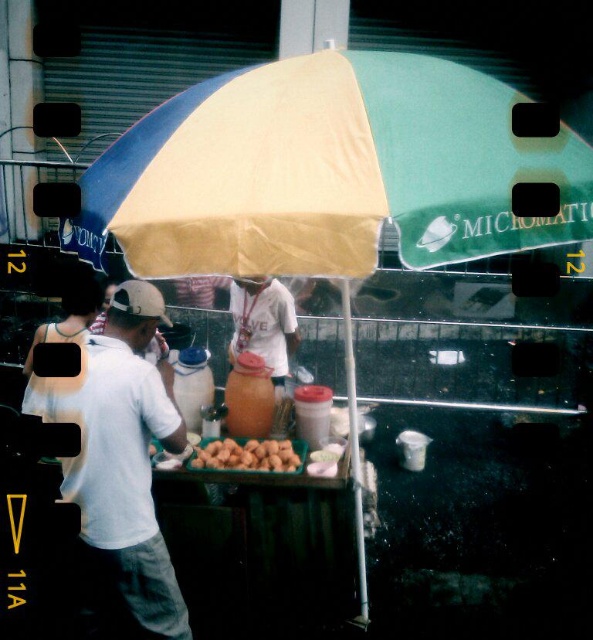
At what (x,y) coordinates should I click in order to perform the action: click on white matte shirt at center. Please return your answer as a coordinate pair (x, y). This screenshot has height=640, width=593. Looking at the image, I should click on (122, 458).

Measure the distance between white jersey at center and brown matte nuts at center.

A distance of 1.02 meters exists between white jersey at center and brown matte nuts at center.

Between white jersey at center and brown matte nuts at center, which one is positioned lower?

Positioned lower is brown matte nuts at center.

Find the location of a particular element. white jersey at center is located at coordinates (263, 323).

Can you confirm if white matte shirt at center is wider than brown matte nuts at center?

Yes.

Can you confirm if white matte shirt at center is taller than brown matte nuts at center?

Correct, white matte shirt at center is much taller as brown matte nuts at center.

What do you see at coordinates (122, 458) in the screenshot?
I see `white matte shirt at center` at bounding box center [122, 458].

The image size is (593, 640). In order to click on white matte shirt at center in this screenshot , I will do `click(122, 458)`.